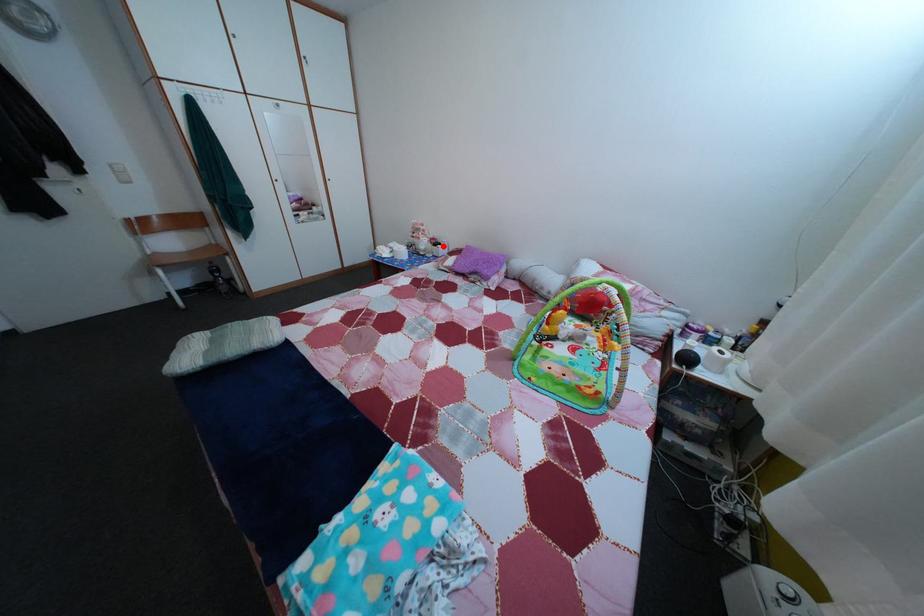
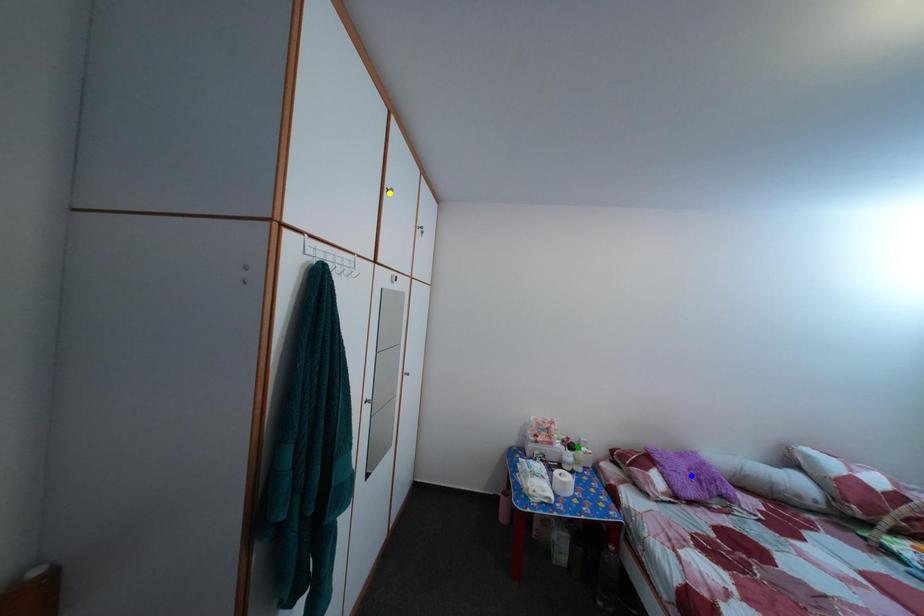
Question: I am providing you with two images of the same scene from different viewpoints. A red point is marked on the first image. You are given multiple points on the second image. In image 2, which mark is for the same physical point as the one in image 1?

Choices:
 (A) green point
 (B) blue point
 (C) yellow point

Answer: (A)